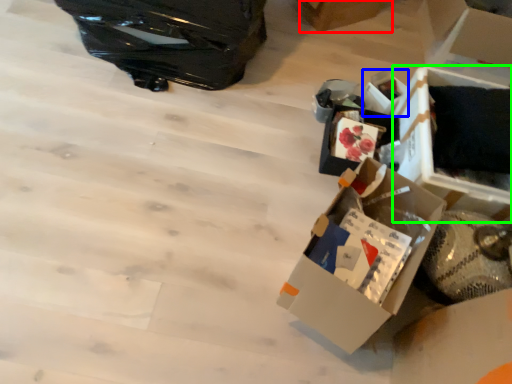
Question: Which object is the closest to the cardboard box (highlighted by a red box)? Choose among these: storage box (highlighted by a blue box) or storage box (highlighted by a green box).

Choices:
 (A) storage box
 (B) storage box

Answer: (A)